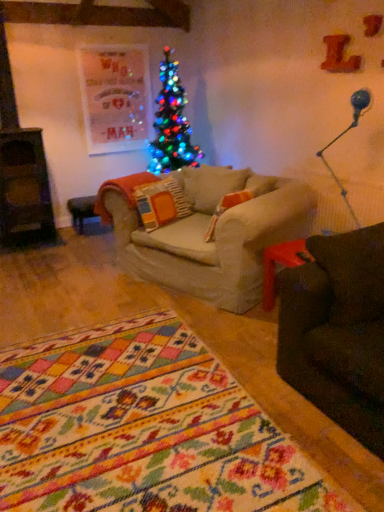
The image size is (384, 512). What do you see at coordinates (343, 135) in the screenshot?
I see `blue glass lamp at upper right` at bounding box center [343, 135].

In order to face blue glass lamp at upper right, should I rotate leftwards or rightwards?

You should look right and rotate roughly 18.925 degrees.

The image size is (384, 512). Find the location of `blue glass lamp at upper right`. blue glass lamp at upper right is located at coordinates (343, 135).

Measure the distance between point (174, 197) and camera.

The depth of point (174, 197) is 3.36 meters.

What do you see at coordinates (161, 203) in the screenshot? I see `knitted woolen pillow at center` at bounding box center [161, 203].

Identify the location of knitted woolen pillow at center. Image resolution: width=384 pixels, height=512 pixels. (161, 203).

Where is `blue glass lamp at upper right`? This screenshot has height=512, width=384. blue glass lamp at upper right is located at coordinates (343, 135).

Based on the photo, which object is positioned more to the right, knitted woolen pillow at center or blue glass lamp at upper right?

blue glass lamp at upper right is more to the right.

Considering their positions, is knitted woolen pillow at center located in front of or behind blue glass lamp at upper right?

In the image, knitted woolen pillow at center appears behind blue glass lamp at upper right.

Does point (150, 231) come behind point (319, 153)?

That is False.

From the image's perspective, which one is positioned higher, knitted woolen pillow at center or blue glass lamp at upper right?

blue glass lamp at upper right, from the image's perspective.

Based on the photo, from a real-world perspective, is knitted woolen pillow at center beneath blue glass lamp at upper right?

Correct, in the physical world, knitted woolen pillow at center is lower than blue glass lamp at upper right.

Can you confirm if knitted woolen pillow at center is thinner than blue glass lamp at upper right?

Incorrect, the width of knitted woolen pillow at center is not less than that of blue glass lamp at upper right.

Can you confirm if knitted woolen pillow at center is shorter than blue glass lamp at upper right?

Yes.

Based on the photo, between knitted woolen pillow at center and blue glass lamp at upper right, which one has larger size?

Bigger between the two is blue glass lamp at upper right.

Is knitted woolen pillow at center positioned beyond the bounds of blue glass lamp at upper right?

Indeed, knitted woolen pillow at center is completely outside blue glass lamp at upper right.

Would you consider knitted woolen pillow at center to be distant from blue glass lamp at upper right?

Yes, knitted woolen pillow at center and blue glass lamp at upper right are quite far apart.

Is knitted woolen pillow at center oriented towards blue glass lamp at upper right?

Yes, knitted woolen pillow at center faces towards blue glass lamp at upper right.

How different are the orientations of knitted woolen pillow at center and blue glass lamp at upper right in degrees?

The angular difference between knitted woolen pillow at center and blue glass lamp at upper right is 101 degrees.

How much distance is there between knitted woolen pillow at center and blue glass lamp at upper right?

knitted woolen pillow at center is 4.22 feet from blue glass lamp at upper right.

Where is `lamp above the knitted woolen pillow at center (from the image's perspective)`? Image resolution: width=384 pixels, height=512 pixels. lamp above the knitted woolen pillow at center (from the image's perspective) is located at coordinates (343, 135).

Can you confirm if blue glass lamp at upper right is positioned to the left of knitted woolen pillow at center?

No, blue glass lamp at upper right is not to the left of knitted woolen pillow at center.

Is blue glass lamp at upper right in front of or behind knitted woolen pillow at center in the image?

Clearly, blue glass lamp at upper right is in front of knitted woolen pillow at center.

Considering the points (361, 98) and (183, 191), which point is behind, point (361, 98) or point (183, 191)?

The point (183, 191) is farther from the camera.

From the image's perspective, relative to knitted woolen pillow at center, is blue glass lamp at upper right above or below?

From the image's perspective, blue glass lamp at upper right appears above knitted woolen pillow at center.

From a real-world perspective, who is located higher, blue glass lamp at upper right or knitted woolen pillow at center?

blue glass lamp at upper right, from a real-world perspective.

Considering the relative sizes of blue glass lamp at upper right and knitted woolen pillow at center in the image provided, is blue glass lamp at upper right wider than knitted woolen pillow at center?

No.

Does blue glass lamp at upper right have a lesser height compared to knitted woolen pillow at center?

No.

Based on their sizes in the image, would you say blue glass lamp at upper right is bigger or smaller than knitted woolen pillow at center?

Clearly, blue glass lamp at upper right is larger in size than knitted woolen pillow at center.

Is blue glass lamp at upper right located outside knitted woolen pillow at center?

Indeed, blue glass lamp at upper right is completely outside knitted woolen pillow at center.

Can you see blue glass lamp at upper right touching knitted woolen pillow at center?

There is a gap between blue glass lamp at upper right and knitted woolen pillow at center.

Is blue glass lamp at upper right facing away from knitted woolen pillow at center?

No, blue glass lamp at upper right is not facing the opposite direction of knitted woolen pillow at center.

What's the angular difference between blue glass lamp at upper right and knitted woolen pillow at center's facing directions?

They differ by 101 degrees in their facing directions.

In the image, there is a blue glass lamp at upper right. Where is `pillow below it (from a real-world perspective)`? This screenshot has height=512, width=384. pillow below it (from a real-world perspective) is located at coordinates (161, 203).

The width and height of the screenshot is (384, 512). Find the location of `lamp on the right of knitted woolen pillow at center`. lamp on the right of knitted woolen pillow at center is located at coordinates (343, 135).

Identify the location of lamp that appears in front of the knitted woolen pillow at center. pyautogui.click(x=343, y=135).